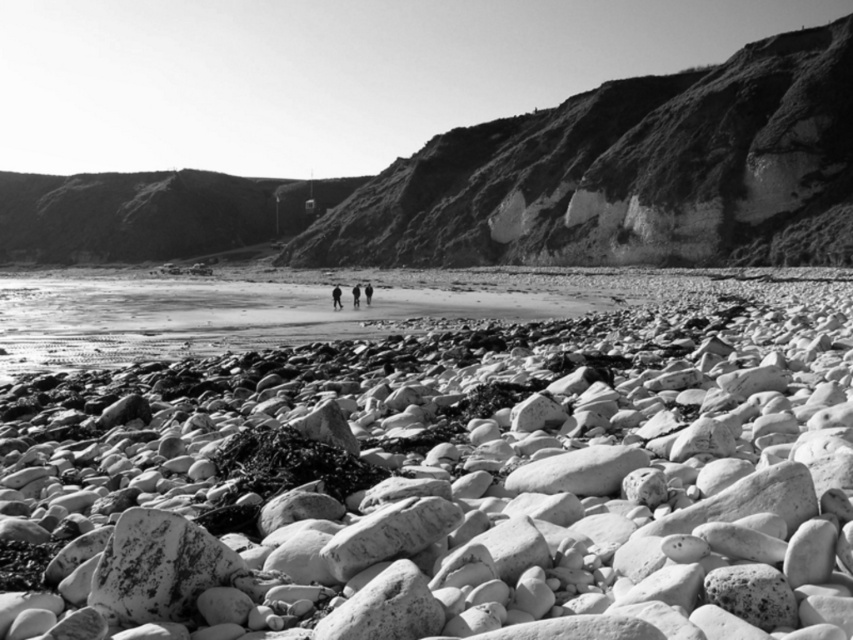
Question: Among these points, which one is farthest from the camera?

Choices:
 (A) (364, 292)
 (B) (672, 90)

Answer: (B)

Question: Considering the real-world distances, which object is farthest from the rough textured cliff at upper right?

Choices:
 (A) smooth skin person at center
 (B) dark fabric figure at center
 (C) smooth pebbles at center

Answer: (B)

Question: Does smooth pebbles at center appear under smooth skin person at center?

Choices:
 (A) no
 (B) yes

Answer: (B)

Question: Observing the image, what is the correct spatial positioning of rough textured cliff at upper right in reference to dark fabric figure at center?

Choices:
 (A) left
 (B) right

Answer: (B)

Question: Which object appears farthest from the camera in this image?

Choices:
 (A) smooth skin person at center
 (B) smooth pebbles at center
 (C) dark fabric pants at center

Answer: (C)

Question: Can you confirm if dark fabric figure at center is thinner than dark fabric pants at center?

Choices:
 (A) no
 (B) yes

Answer: (B)